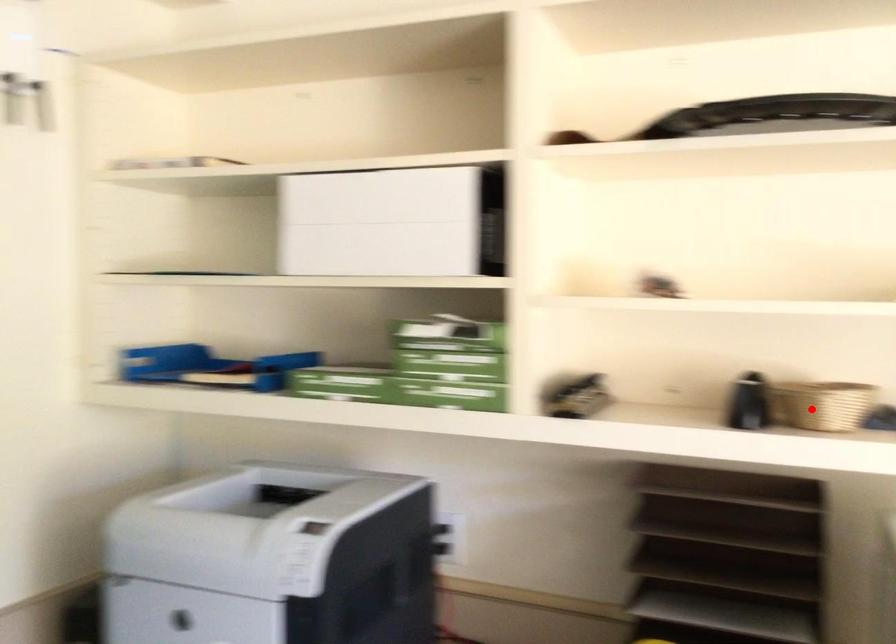
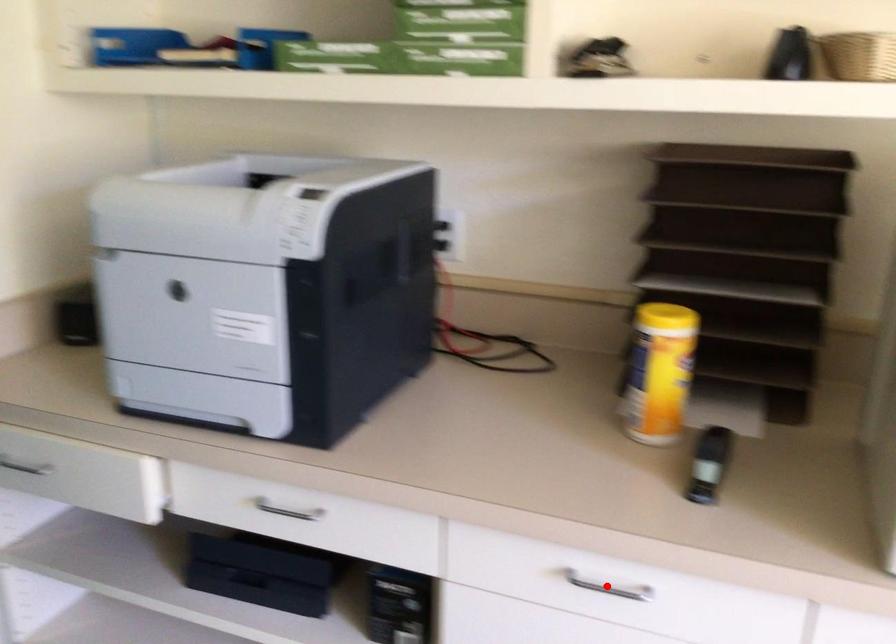
I am providing you with two images of the same scene from different viewpoints. A red point is marked on the first image and another point is marked on the second image. Is the red point in image1 aligned with the point shown in image2?

No